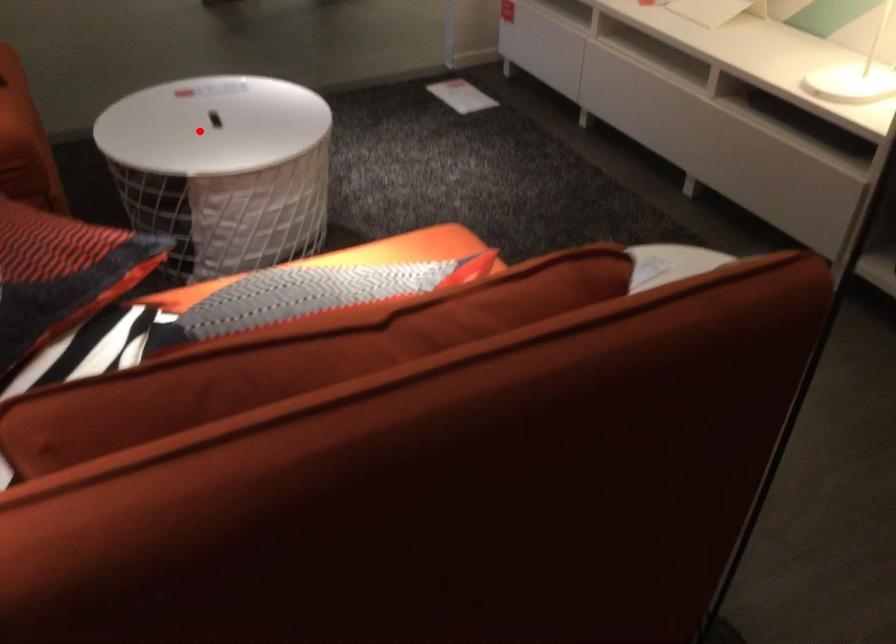
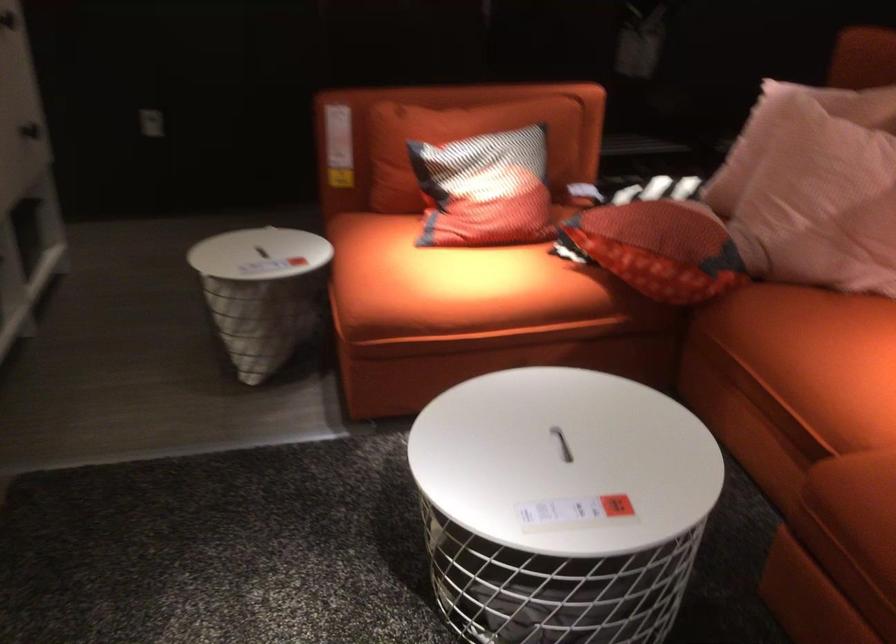
Find the pixel in the second image that matches the highlighted location in the first image.

(562, 444)